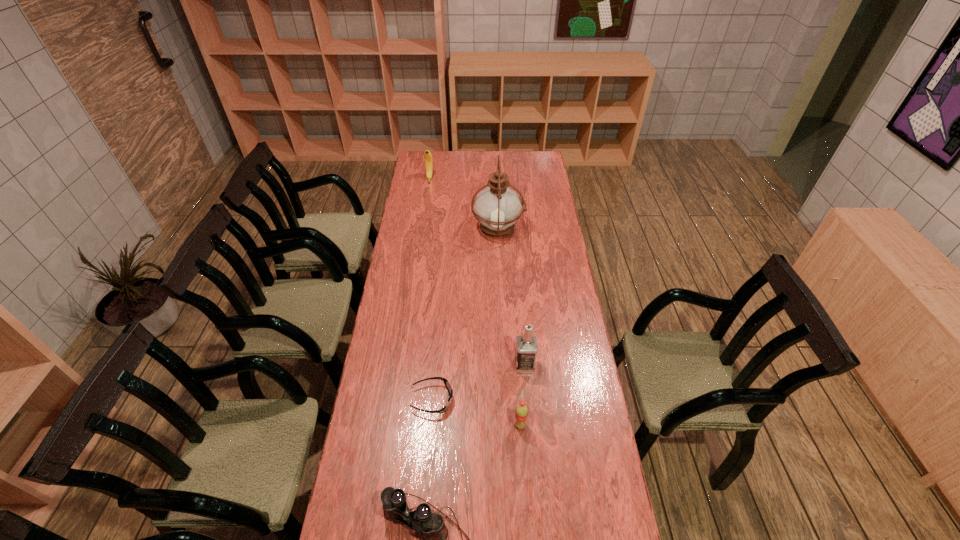
I want to click on free spot between the banana and the fifth shortest object, so click(x=477, y=272).

Locate which object ranks third in proximity to the nearest object. Please provide its 2D coordinates. Your answer should be formatted as a tuple, i.e. [(x, y)], where the tuple contains the x and y coordinates of a point satisfying the conditions above.

[(526, 345)]

Locate which object ranks second in proximity to the banana. Please provide its 2D coordinates. Your answer should be formatted as a tuple, i.e. [(x, y)], where the tuple contains the x and y coordinates of a point satisfying the conditions above.

[(526, 345)]

Where is `vacant region that satisfies the following two spatial constraints: 1. from the stem of the soda; 2. on the left side of the banana`? vacant region that satisfies the following two spatial constraints: 1. from the stem of the soda; 2. on the left side of the banana is located at coordinates (394, 425).

Image resolution: width=960 pixels, height=540 pixels. Identify the location of free location that satisfies the following two spatial constraints: 1. on the lenses of the shortest object; 2. on the back side of the soda. [x=430, y=425].

You are a GUI agent. You are given a task and a screenshot of the screen. Output one action in this format:
    pyautogui.click(x=<x>, y=<y>)
    Task: Click on the vacant region that satisfies the following two spatial constraints: 1. on the lenses of the soda; 2. on the right side of the sunglasses
    The height and width of the screenshot is (540, 960).
    Given the screenshot: What is the action you would take?
    pyautogui.click(x=430, y=425)